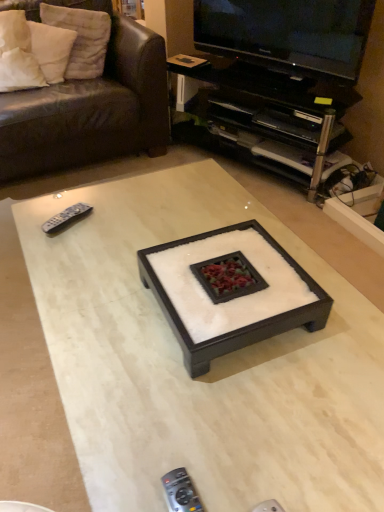
The height and width of the screenshot is (512, 384). I want to click on free space behind gray plastic remote at left, the first remote control viewed from the left, so click(89, 197).